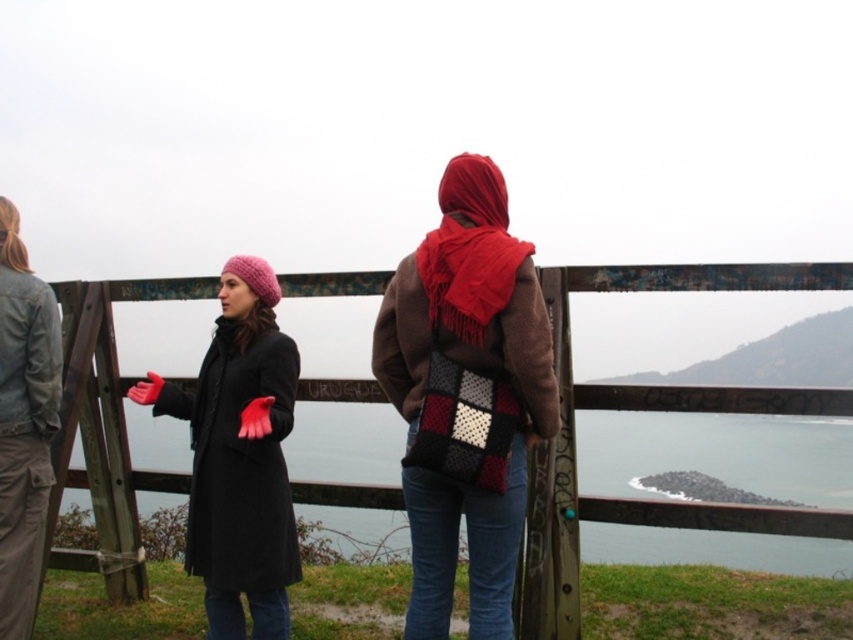
How far apart are wooden at center and red woolen scarf at center?

They are 31.66 inches apart.

Which is below, wooden at center or red woolen scarf at center?

wooden at center is lower down.

Who is more distant from viewer, (131, 572) or (488, 234)?

Point (131, 572)

Find the location of a particular element. The height and width of the screenshot is (640, 853). wooden at center is located at coordinates (660, 410).

Can you confirm if matte black coat at center is wider than denim jacket at left?

Yes.

Does matte black coat at center have a smaller size compared to denim jacket at left?

Actually, matte black coat at center might be larger than denim jacket at left.

Image resolution: width=853 pixels, height=640 pixels. Describe the element at coordinates (239, 456) in the screenshot. I see `matte black coat at center` at that location.

At what (x,y) coordinates should I click in order to perform the action: click on matte black coat at center. Please return your answer as a coordinate pair (x, y). This screenshot has width=853, height=640. Looking at the image, I should click on (239, 456).

The height and width of the screenshot is (640, 853). What do you see at coordinates (466, 396) in the screenshot? I see `knitted wool scarf at center` at bounding box center [466, 396].

Is knitted wool scarf at center to the right of red woolen scarf at center from the viewer's perspective?

Incorrect, knitted wool scarf at center is not on the right side of red woolen scarf at center.

Image resolution: width=853 pixels, height=640 pixels. What do you see at coordinates (466, 396) in the screenshot? I see `knitted wool scarf at center` at bounding box center [466, 396].

What are the coordinates of `knitted wool scarf at center` in the screenshot? It's located at (x=466, y=396).